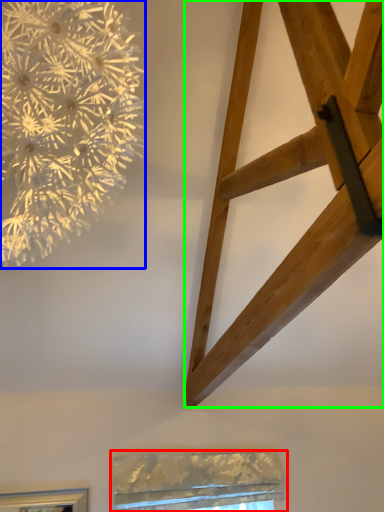
Question: Which is farther away from window (highlighted by a red box)? flower (highlighted by a blue box) or furniture (highlighted by a green box)?

Choices:
 (A) flower
 (B) furniture

Answer: (A)